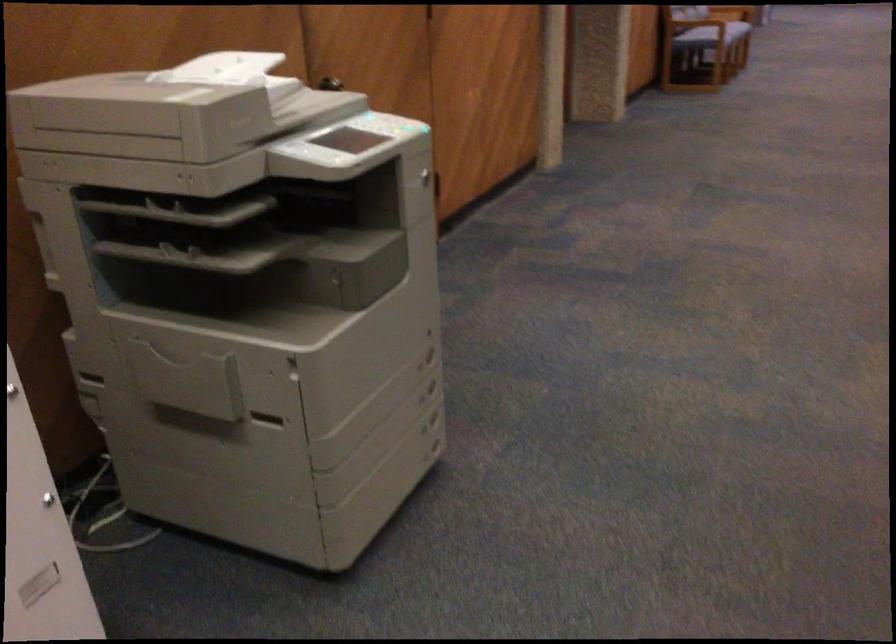
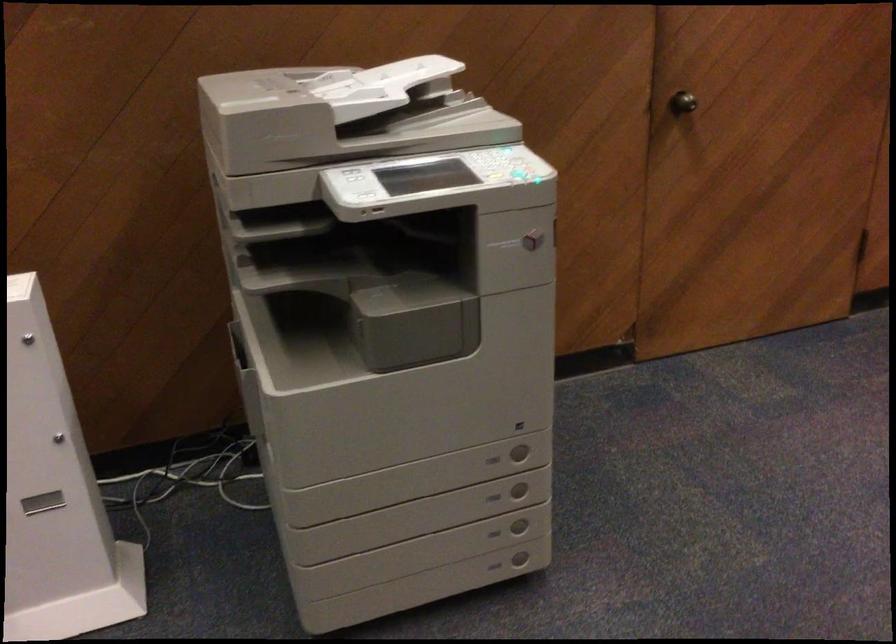
Locate, in the second image, the point that corresponds to point (431, 433) in the first image.

(494, 533)